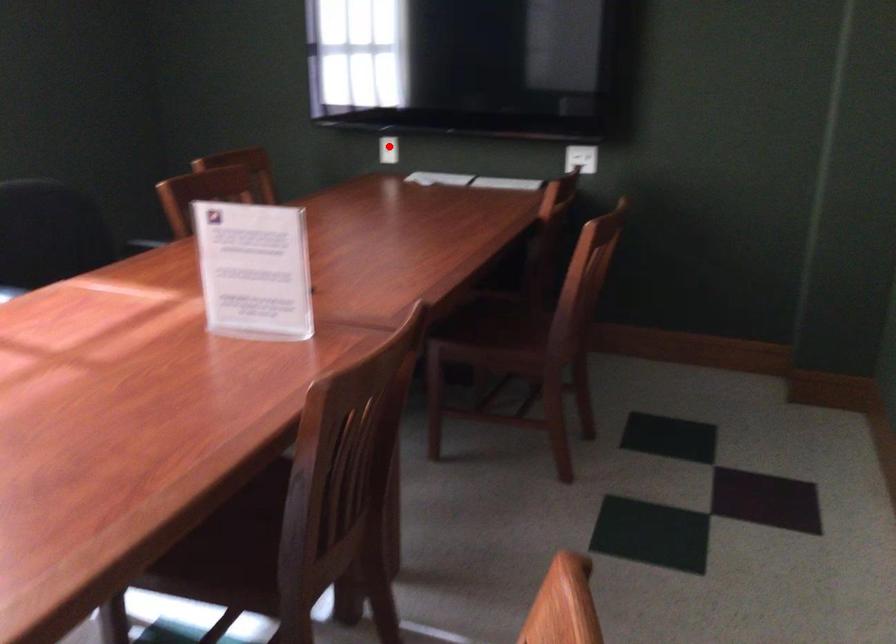
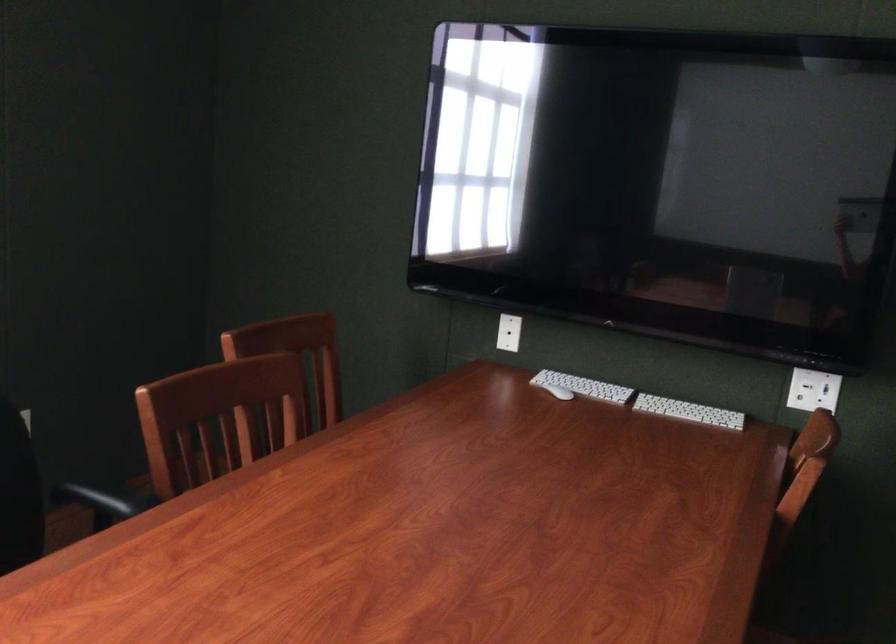
Question: I am providing you with two images of the same scene from different viewpoints. In image1, a red point is highlighted. Considering the same 3D point in image2, which of the following is correct?

Choices:
 (A) It is closer
 (B) It is farther

Answer: (A)